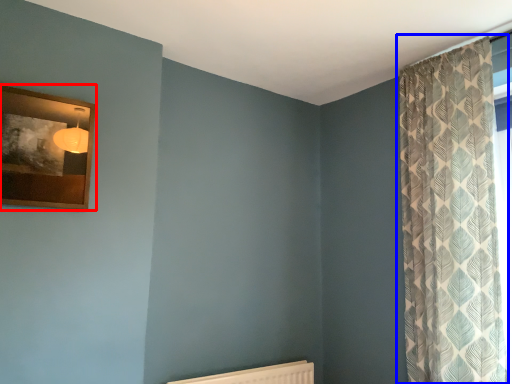
Question: Which object appears closest to the camera in this image, picture frame (highlighted by a red box) or curtain (highlighted by a blue box)?

Choices:
 (A) picture frame
 (B) curtain

Answer: (A)